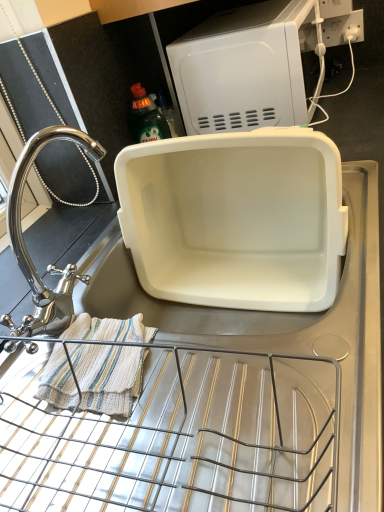
Question: Is white plastic electric outlet at upper right facing away from white plastic container at center, the 1th appliance positioned from the bottom?

Choices:
 (A) yes
 (B) no

Answer: (B)

Question: From a real-world perspective, does white plastic electric outlet at upper right sit lower than white plastic container at center, which is the second appliance from top to bottom?

Choices:
 (A) yes
 (B) no

Answer: (B)

Question: From a real-world perspective, is white plastic electric outlet at upper right physically above white plastic container at center, the 1th appliance positioned from the bottom?

Choices:
 (A) no
 (B) yes

Answer: (B)

Question: Would you consider white plastic electric outlet at upper right to be distant from white plastic container at center, which is the second appliance from top to bottom?

Choices:
 (A) yes
 (B) no

Answer: (B)

Question: Considering the relative sizes of white plastic electric outlet at upper right and white plastic container at center, which is the second appliance from top to bottom, in the image provided, is white plastic electric outlet at upper right taller than white plastic container at center, which is the second appliance from top to bottom,?

Choices:
 (A) yes
 (B) no

Answer: (B)

Question: Considering the positions of white plastic electric outlet at upper right and white plastic container at center, the 1th appliance positioned from the bottom, in the image, is white plastic electric outlet at upper right taller or shorter than white plastic container at center, the 1th appliance positioned from the bottom,?

Choices:
 (A) short
 (B) tall

Answer: (A)

Question: From a real-world perspective, is white plastic electric outlet at upper right positioned above or below white plastic container at center, which is the second appliance from top to bottom?

Choices:
 (A) above
 (B) below

Answer: (A)

Question: In terms of size, does white plastic electric outlet at upper right appear bigger or smaller than white plastic container at center, the 1th appliance positioned from the bottom?

Choices:
 (A) small
 (B) big

Answer: (A)

Question: Looking at their shapes, would you say white plastic electric outlet at upper right is wider or thinner than white plastic container at center, the 1th appliance positioned from the bottom?

Choices:
 (A) wide
 (B) thin

Answer: (B)

Question: Considering the positions of point (220, 34) and point (33, 142), is point (220, 34) closer or farther from the camera than point (33, 142)?

Choices:
 (A) farther
 (B) closer

Answer: (A)

Question: From their relative heights in the image, would you say white plastic microwave at upper center, the 1th appliance in the top-to-bottom sequence, is taller or shorter than polished chrome faucet at left?

Choices:
 (A) tall
 (B) short

Answer: (B)

Question: Is white plastic microwave at upper center, placed as the 2th appliance when sorted from bottom to top, situated inside polished chrome faucet at left or outside?

Choices:
 (A) inside
 (B) outside

Answer: (B)

Question: Visually, is white plastic microwave at upper center, the 1th appliance in the top-to-bottom sequence, positioned to the left or to the right of polished chrome faucet at left?

Choices:
 (A) left
 (B) right

Answer: (B)

Question: Visually, is white plastic microwave at upper center, placed as the 2th appliance when sorted from bottom to top, positioned to the left or to the right of white plastic container at center, the 1th appliance positioned from the bottom?

Choices:
 (A) left
 (B) right

Answer: (B)

Question: In terms of width, does white plastic microwave at upper center, placed as the 2th appliance when sorted from bottom to top, look wider or thinner when compared to white plastic container at center, the 1th appliance positioned from the bottom?

Choices:
 (A) wide
 (B) thin

Answer: (A)